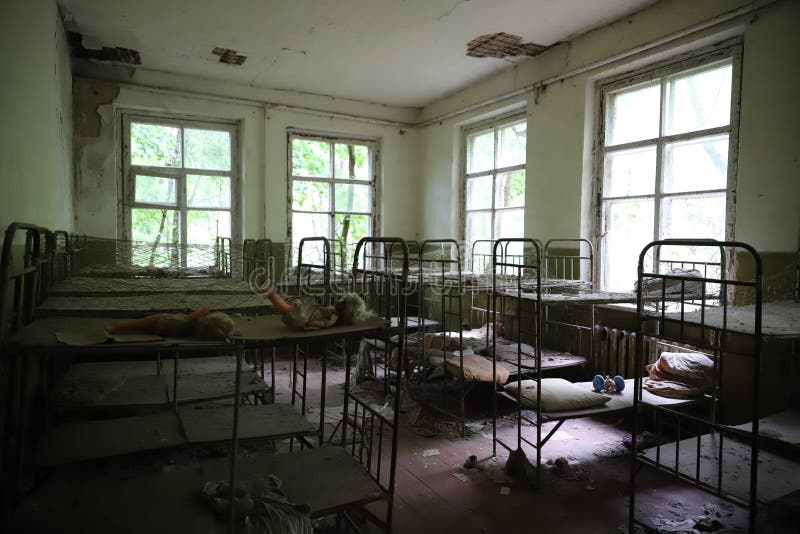
Find any where you lie on a bed in the image. Your answer should be formatted as a list of tuples, i.e. [(x1, y1), (x2, y2), ...], where each tuple contains the x and y coordinates of a point satisfying the conditions above.

[(260, 329), (288, 479), (614, 397), (600, 295), (257, 426), (197, 391)]